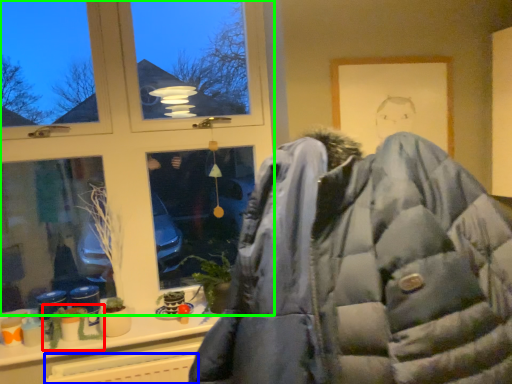
Question: Based on their relative distances, which object is farther from plant (highlighted by a red box)? Choose from radiator (highlighted by a blue box) and window (highlighted by a green box).

Choices:
 (A) radiator
 (B) window

Answer: (B)